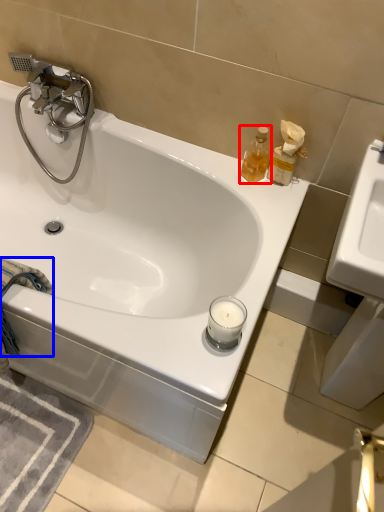
Question: Among these objects, which one is farthest to the camera, soap dispenser (highlighted by a red box) or bath towel (highlighted by a blue box)?

Choices:
 (A) soap dispenser
 (B) bath towel

Answer: (A)